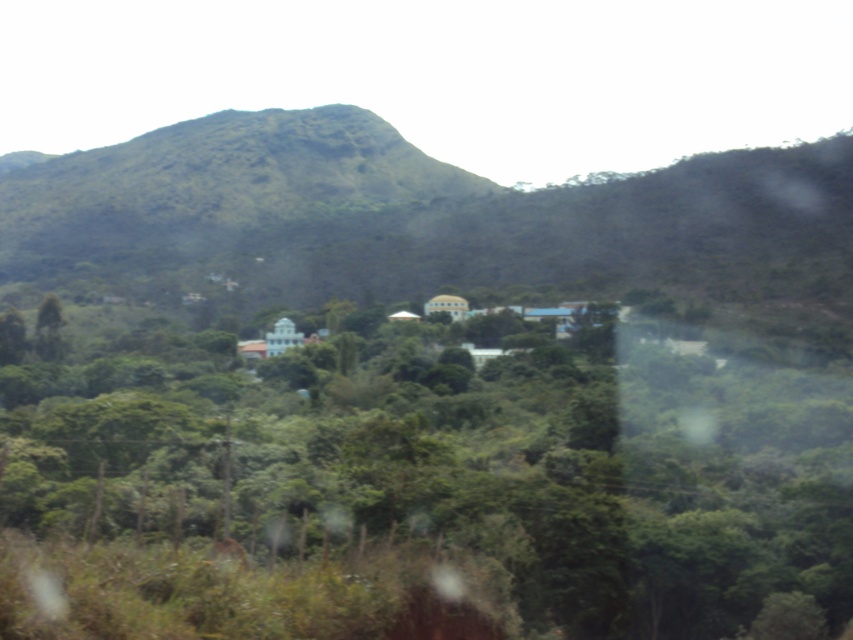
Question: Can you confirm if green leafy tree at center is thinner than green grassy mountain at center?

Choices:
 (A) yes
 (B) no

Answer: (A)

Question: Can you confirm if green leafy tree at center is positioned to the right of green grassy mountain at center?

Choices:
 (A) no
 (B) yes

Answer: (B)

Question: Which point is farther to the camera?

Choices:
 (A) green grassy mountain at center
 (B) green leafy tree at center

Answer: (A)

Question: Is green leafy tree at center behind green grassy mountain at center?

Choices:
 (A) no
 (B) yes

Answer: (A)

Question: Among these points, which one is farthest from the camera?

Choices:
 (A) (378, 460)
 (B) (572, 218)

Answer: (B)

Question: Which of the following is the farthest from the observer?

Choices:
 (A) green grassy mountain at center
 (B) green leafy tree at center

Answer: (A)